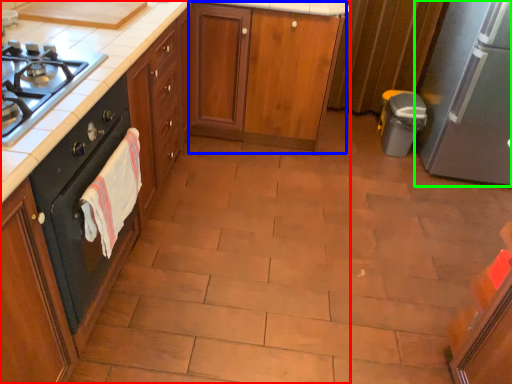
Question: Which object is positioned farthest from cabinetry (highlighted by a red box)? Select from cabinetry (highlighted by a blue box) and kitchen appliance (highlighted by a green box).

Choices:
 (A) cabinetry
 (B) kitchen appliance

Answer: (B)